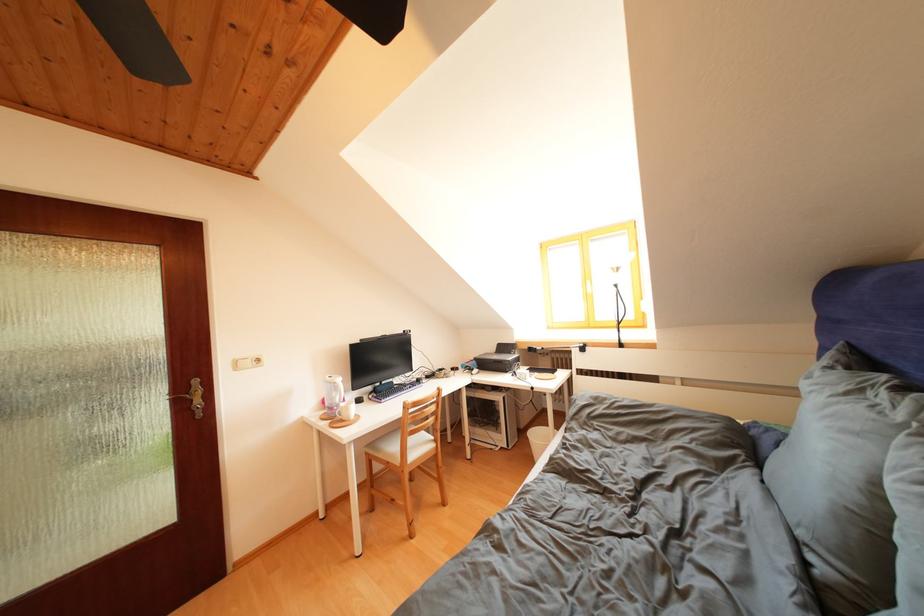
I want to click on light switch, so click(247, 362).